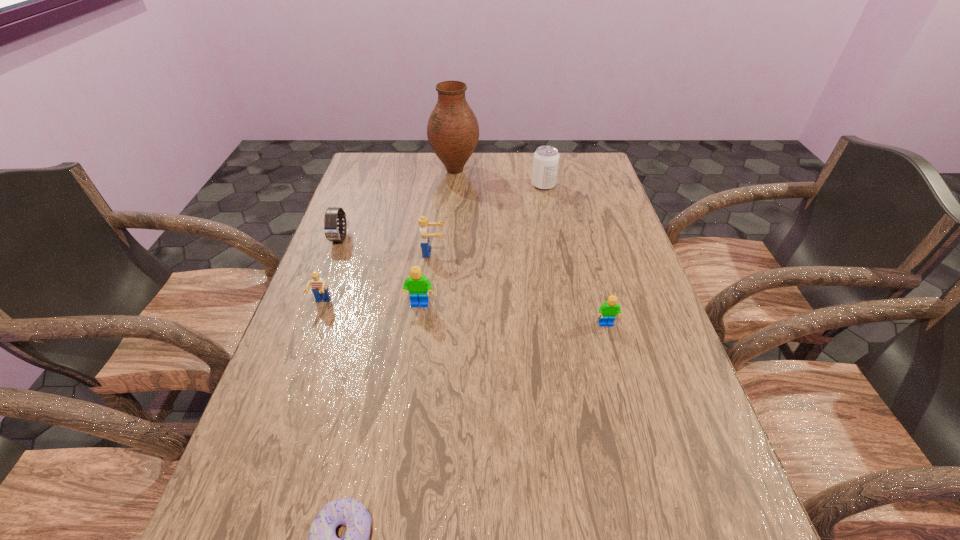
Find the location of a particular element. This screenshot has height=540, width=960. watch that is at the left edge is located at coordinates (332, 233).

Identify the location of Lego that is at the left edge. The width and height of the screenshot is (960, 540). (319, 287).

Identify the location of object at the right edge. (607, 311).

Where is `vacant space at the far edge of the desktop`? This screenshot has height=540, width=960. vacant space at the far edge of the desktop is located at coordinates (526, 177).

The image size is (960, 540). I want to click on vacant space at the left edge, so click(x=358, y=247).

In the image, there is a desktop. Identify the location of free space at the right edge. The width and height of the screenshot is (960, 540). (630, 256).

The height and width of the screenshot is (540, 960). Find the location of `vacant space at the far left corner`. vacant space at the far left corner is located at coordinates (399, 166).

At what (x,y) coordinates should I click in order to perform the action: click on free space at the far right corner. Please return your answer as a coordinate pair (x, y). This screenshot has width=960, height=540. Looking at the image, I should click on (593, 162).

Locate an element on the screen. free point between the nearer blue Lego and the left green Lego is located at coordinates (371, 304).

Find the location of `free space between the farthest Lego and the watch`. free space between the farthest Lego and the watch is located at coordinates pyautogui.click(x=386, y=245).